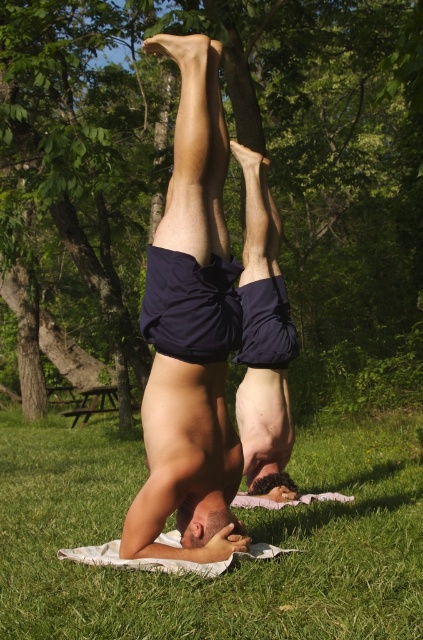
Question: Which point is closer to the camera?

Choices:
 (A) green grass at lower center
 (B) matte blue shorts at center
 (C) green leafy tree at upper center

Answer: (A)

Question: Is green leafy tree at upper center to the left of matte blue shorts at center from the viewer's perspective?

Choices:
 (A) no
 (B) yes

Answer: (B)

Question: Which object is the closest to the matte blue shorts at center?

Choices:
 (A) green leafy tree at upper center
 (B) green grass at lower center

Answer: (B)

Question: Is green grass at lower center positioned at the back of matte blue shorts at center?

Choices:
 (A) no
 (B) yes

Answer: (A)

Question: Where is green leafy tree at upper center located in relation to green grass at lower center in the image?

Choices:
 (A) below
 (B) above

Answer: (B)

Question: Which of the following is the farthest from the observer?

Choices:
 (A) green grass at lower center
 (B) green leafy tree at upper center
 (C) matte blue shorts at center

Answer: (B)